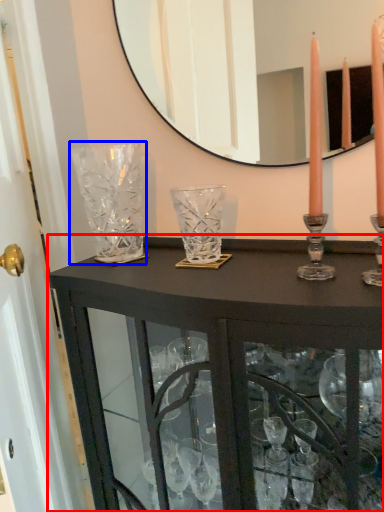
Question: Which object appears closest to the camera in this image, table (highlighted by a red box) or glass vase (highlighted by a blue box)?

Choices:
 (A) table
 (B) glass vase

Answer: (A)